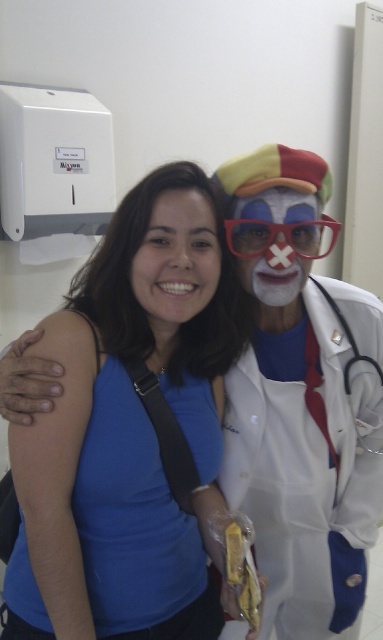
Is point (178, 314) less distant than point (230, 221)?

That is True.

Is matte blue shirt at center smaller than transparent plastic goggles at center?

Actually, matte blue shirt at center might be larger than transparent plastic goggles at center.

This screenshot has width=383, height=640. Describe the element at coordinates (176, 259) in the screenshot. I see `matte blue shirt at center` at that location.

Where is `matte blue shirt at center`? The height and width of the screenshot is (640, 383). matte blue shirt at center is located at coordinates (176, 259).

Which of these two, blue matte shirt at center or matte blue shirt at center, stands taller?

blue matte shirt at center

Measure the distance between blue matte shirt at center and camera.

The distance of blue matte shirt at center from camera is 78.51 centimeters.

The width and height of the screenshot is (383, 640). What are the coordinates of `blue matte shirt at center` in the screenshot? It's located at (132, 436).

Can you confirm if matte blue shirt at center is wider than matte clown face at center?

Incorrect, matte blue shirt at center's width does not surpass matte clown face at center's.

Which is behind, point (201, 291) or point (263, 294)?

The point (263, 294) is more distant.

The width and height of the screenshot is (383, 640). I want to click on matte blue shirt at center, so coord(176,259).